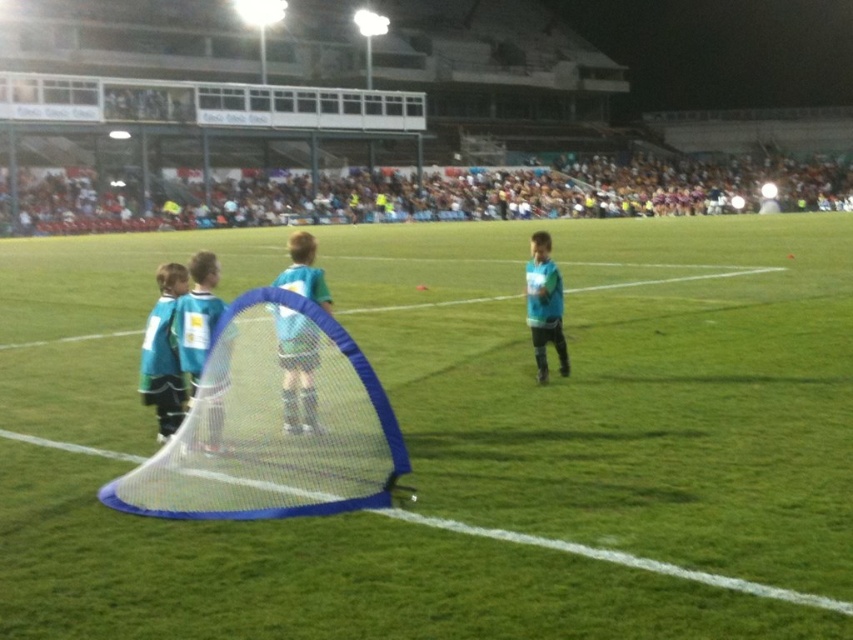
You are a photographer standing at the edge of the soccer field. You want to take a photo that includes both the white mesh net at center and the light blue jersey at right. What is the minimum distance you need to move backward to ensure both objects are in frame?

The white mesh net at center and the light blue jersey at right are 11.57 feet apart. To include both in your photo, you need to move back at least 11.57 feet to ensure the entire distance between them fits within the camera frame.